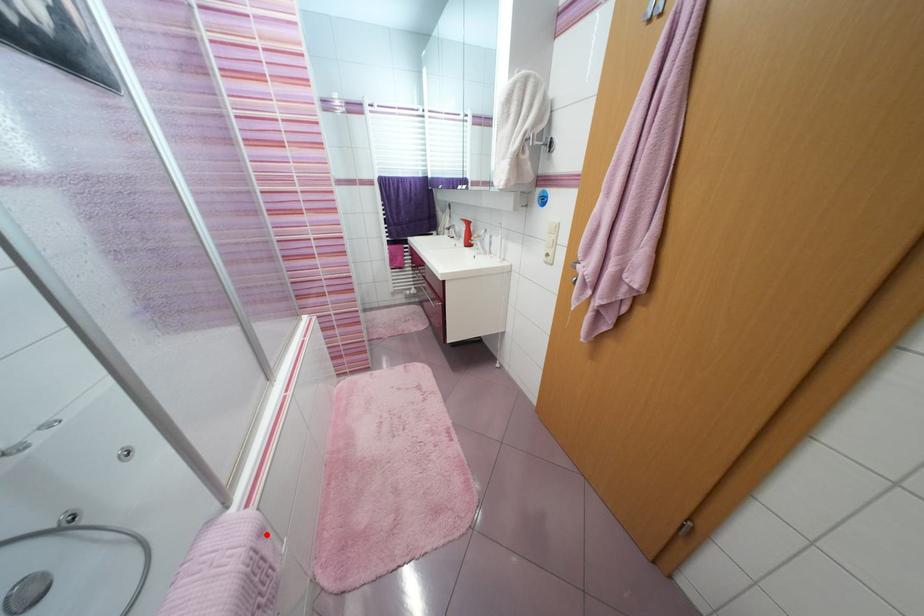
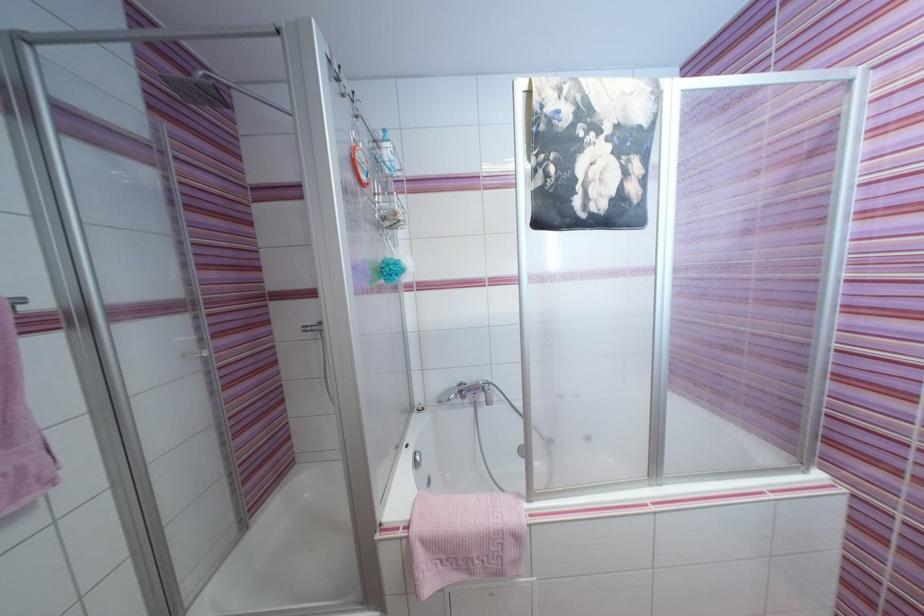
Question: I am providing you with two images of the same scene from different viewpoints. A red point is shown in image1. For the corresponding object point in image2, is it positioned nearer or farther from the camera?

Choices:
 (A) Nearer
 (B) Farther

Answer: (B)